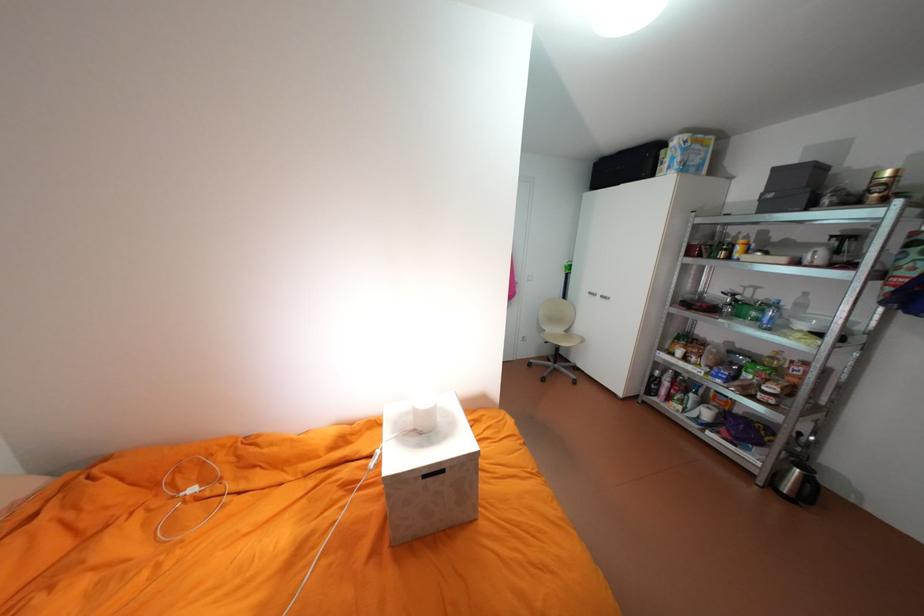
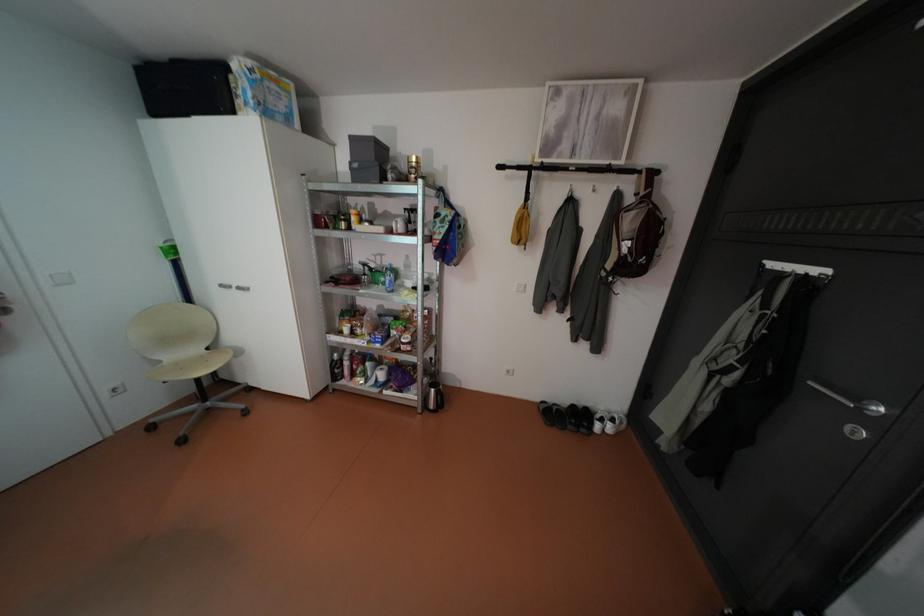
Find the pixel in the second image that matches point 611,296 in the first image.

(248, 286)